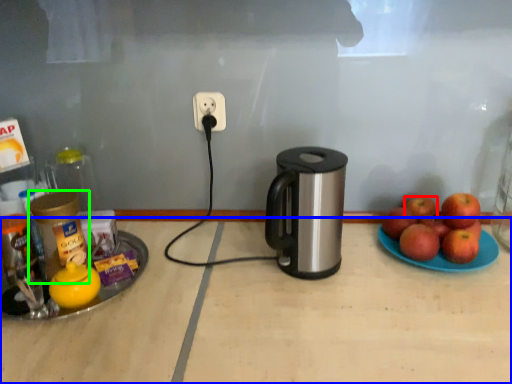
Question: Estimate the real-world distances between objects in this image. Which object is closer to apple (highlighted by a red box), table (highlighted by a blue box) or bottle (highlighted by a green box)?

Choices:
 (A) table
 (B) bottle

Answer: (A)